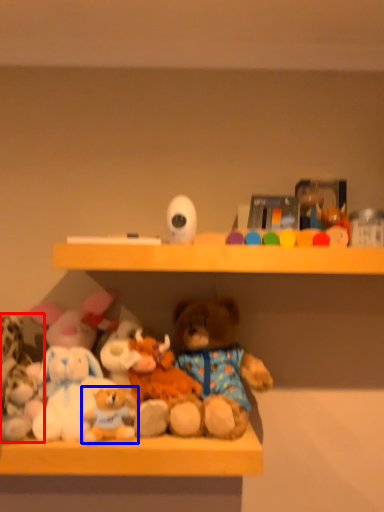
Question: Which point is further to the camera, toy (highlighted by a red box) or toy (highlighted by a blue box)?

Choices:
 (A) toy
 (B) toy

Answer: (A)